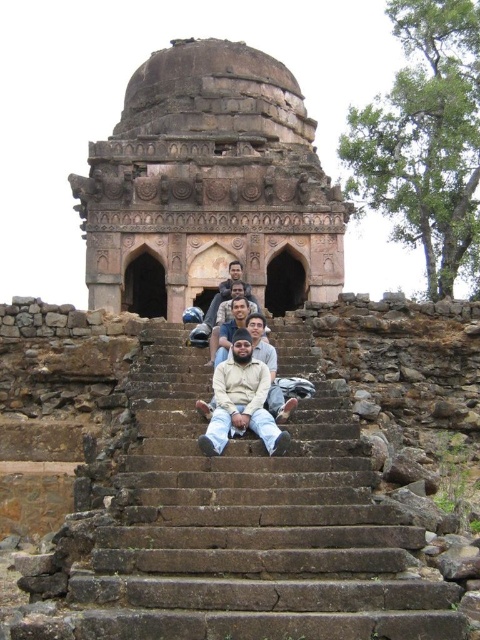
Question: Is brown stone stairs at center to the right of rustic stone dome at center from the viewer's perspective?

Choices:
 (A) no
 (B) yes

Answer: (B)

Question: From the image, what is the correct spatial relationship of rustic stone dome at center in relation to beige cotton shirt at center?

Choices:
 (A) above
 (B) below

Answer: (A)

Question: Which object is positioned farthest from the rustic stone dome at center?

Choices:
 (A) brown stone stairs at center
 (B) beige cotton shirt at center

Answer: (B)

Question: Estimate the real-world distances between objects in this image. Which object is closer to the rustic stone dome at center?

Choices:
 (A) brown stone stairs at center
 (B) beige cotton shirt at center

Answer: (A)

Question: From the image, what is the correct spatial relationship of brown stone stairs at center in relation to rustic stone dome at center?

Choices:
 (A) right
 (B) left

Answer: (A)

Question: Which point is farther to the camera?

Choices:
 (A) rustic stone dome at center
 (B) beige cotton shirt at center

Answer: (A)